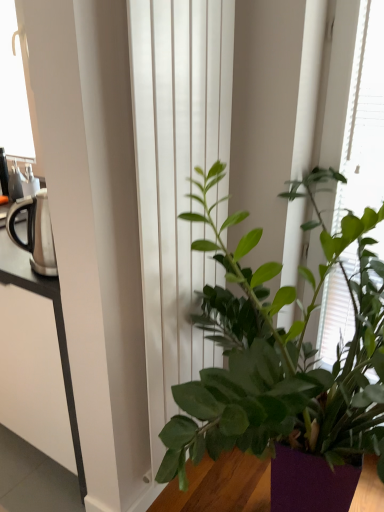
This screenshot has width=384, height=512. What do you see at coordinates (285, 362) in the screenshot?
I see `green matte plant at center` at bounding box center [285, 362].

Measure the distance between point (299, 342) and camera.

They are 3.53 feet apart.

This screenshot has width=384, height=512. I want to click on green matte plant at center, so click(x=285, y=362).

From the image's perspective, is green matte plant at center beneath silver metallic kettle at left?

Yes, from the image's perspective, green matte plant at center is beneath silver metallic kettle at left.

Is green matte plant at center bigger or smaller than silver metallic kettle at left?

green matte plant at center is bigger than silver metallic kettle at left.

There is a green matte plant at center. Identify the location of appliance above it (from a real-world perspective). This screenshot has width=384, height=512. (35, 232).

Can you confirm if green matte plant at center is shorter than silver metallic kettle at left?

In fact, green matte plant at center may be taller than silver metallic kettle at left.

Locate an element on the screen. The width and height of the screenshot is (384, 512). curtain that appears on the left of green matte plant at center is located at coordinates (177, 179).

Is green matte plant at center facing away from white smooth curtain at center?

green matte plant at center is not turned away from white smooth curtain at center.

From a real-world perspective, does green matte plant at center sit lower than white smooth curtain at center?

Yes.

Considering the sizes of objects green matte plant at center and white smooth curtain at center in the image provided, who is bigger, green matte plant at center or white smooth curtain at center?

With larger size is green matte plant at center.

From the picture: Is silver metallic kettle at left thinner than white smooth curtain at center?

No, silver metallic kettle at left is not thinner than white smooth curtain at center.

Would you say white smooth curtain at center is part of silver metallic kettle at left's contents?

No, white smooth curtain at center is located outside of silver metallic kettle at left.

Between point (48, 206) and point (161, 172), which one is positioned behind?

Point (48, 206)

What's the angular difference between silver metallic kettle at left and white smooth curtain at center's facing directions?

92.2 degrees.

From the picture: Between white smooth curtain at center and green leafy plant at center, which one appears on the left side from the viewer's perspective?

Positioned to the left is white smooth curtain at center.

From a real-world perspective, is white smooth curtain at center below green leafy plant at center?

Incorrect, from a real-world perspective, white smooth curtain at center is higher than green leafy plant at center.

Can you see white smooth curtain at center touching green leafy plant at center?

No, white smooth curtain at center is not touching green leafy plant at center.

From a real-world perspective, is white smooth curtain at center positioned above or below green matte plant at center?

white smooth curtain at center is situated higher than green matte plant at center in the real world.

From the picture: Is white smooth curtain at center far from green matte plant at center?

No, white smooth curtain at center is in close proximity to green matte plant at center.

Is white smooth curtain at center looking in the opposite direction of green matte plant at center?

Absolutely, white smooth curtain at center is directed away from green matte plant at center.

Is white smooth curtain at center to the left or to the right of green matte plant at center in the image?

Clearly, white smooth curtain at center is on the left of green matte plant at center in the image.

Which is in front, green matte plant at center or green leafy plant at center?

green matte plant at center.

Is green matte plant at center looking in the opposite direction of green leafy plant at center?

Yes, green matte plant at center is positioned with its back facing green leafy plant at center.

From the image's perspective, is green matte plant at center located above green leafy plant at center?

No.

Consider the image. Considering the sizes of objects green leafy plant at center and white smooth curtain at center in the image provided, who is bigger, green leafy plant at center or white smooth curtain at center?

With larger size is green leafy plant at center.

Is green leafy plant at center taller or shorter than white smooth curtain at center?

Considering their sizes, green leafy plant at center has more height than white smooth curtain at center.

Are green leafy plant at center and white smooth curtain at center located far from each other?

Actually, green leafy plant at center and white smooth curtain at center are a little close together.

Can you confirm if green leafy plant at center is wider than white smooth curtain at center?

Yes.

At what (x,y) coordinates should I click in order to perform the action: click on appliance behind the green matte plant at center. Please return your answer as a coordinate pair (x, y). The width and height of the screenshot is (384, 512). Looking at the image, I should click on (35, 232).

Image resolution: width=384 pixels, height=512 pixels. In order to click on curtain above the green matte plant at center (from the image's perspective) in this screenshot , I will do `click(177, 179)`.

Which object lies nearer to the anchor point silver metallic kettle at left, green matte plant at center or white smooth curtain at center?

white smooth curtain at center is closer to silver metallic kettle at left.

Based on the photo, from the image, which object appears to be farther from green matte plant at center, white smooth curtain at center or silver metallic kettle at left?

Among the two, silver metallic kettle at left is located further to green matte plant at center.

Looking at the image, which one is located further to white smooth curtain at center, green leafy plant at center or green matte plant at center?

green leafy plant at center is positioned further to the anchor white smooth curtain at center.

When comparing their distances from green leafy plant at center, does white smooth curtain at center or silver metallic kettle at left seem further?

The object further to green leafy plant at center is silver metallic kettle at left.

Considering their positions, is white smooth curtain at center positioned further to silver metallic kettle at left than green leafy plant at center?

green leafy plant at center.

Which object lies further to the anchor point green matte plant at center, green leafy plant at center or silver metallic kettle at left?

Among the two, silver metallic kettle at left is located further to green matte plant at center.

Which object lies nearer to the anchor point green leafy plant at center, green matte plant at center or white smooth curtain at center?

The object closer to green leafy plant at center is green matte plant at center.

From the image, which object appears to be farther from green matte plant at center, green leafy plant at center or white smooth curtain at center?

Among the two, green leafy plant at center is located further to green matte plant at center.

The width and height of the screenshot is (384, 512). Find the location of `curtain located between green matte plant at center and green leafy plant at center in the depth direction`. curtain located between green matte plant at center and green leafy plant at center in the depth direction is located at coordinates (177, 179).

Where is `curtain between green matte plant at center and silver metallic kettle at left in the front-back direction`? The width and height of the screenshot is (384, 512). curtain between green matte plant at center and silver metallic kettle at left in the front-back direction is located at coordinates (177, 179).

The image size is (384, 512). Identify the location of houseplant situated between silver metallic kettle at left and green leafy plant at center from left to right. (285, 362).

What are the coordinates of `curtain between silver metallic kettle at left and green leafy plant at center from left to right` in the screenshot? It's located at (177, 179).